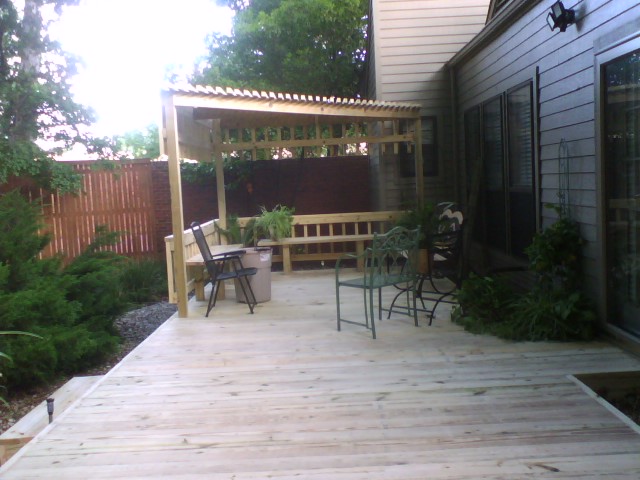
I want to click on windows, so click(412, 156), click(475, 151), click(493, 153), click(524, 153).